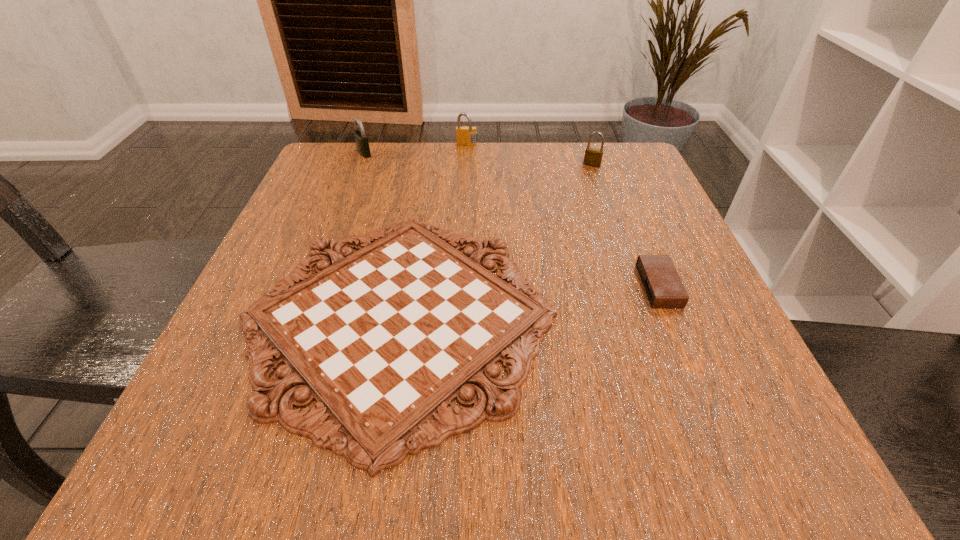
Where is `object that is positioned at the far right corner`? This screenshot has width=960, height=540. object that is positioned at the far right corner is located at coordinates (593, 157).

This screenshot has height=540, width=960. In the image, there is a desktop. What are the coordinates of `free space at the far edge` in the screenshot? It's located at (523, 155).

What are the coordinates of `vacant position at the near edge of the desktop` in the screenshot? It's located at (560, 463).

This screenshot has height=540, width=960. I want to click on vacant region at the left edge of the desktop, so click(366, 215).

Find the location of a particular element. free space at the right edge of the desktop is located at coordinates (684, 269).

This screenshot has height=540, width=960. Identify the location of vacant region at the far left corner of the desktop. (335, 198).

I want to click on vacant region at the near left corner of the desktop, so click(x=203, y=423).

Find the location of `vacant space at the far right corner of the desktop`. vacant space at the far right corner of the desktop is located at coordinates (615, 181).

Locate an element on the screen. Image resolution: width=960 pixels, height=540 pixels. free space at the near right corner of the desktop is located at coordinates (805, 476).

Locate an element on the screen. The width and height of the screenshot is (960, 540). vacant space that is in between the third nearest object and the leftmost padlock is located at coordinates (478, 159).